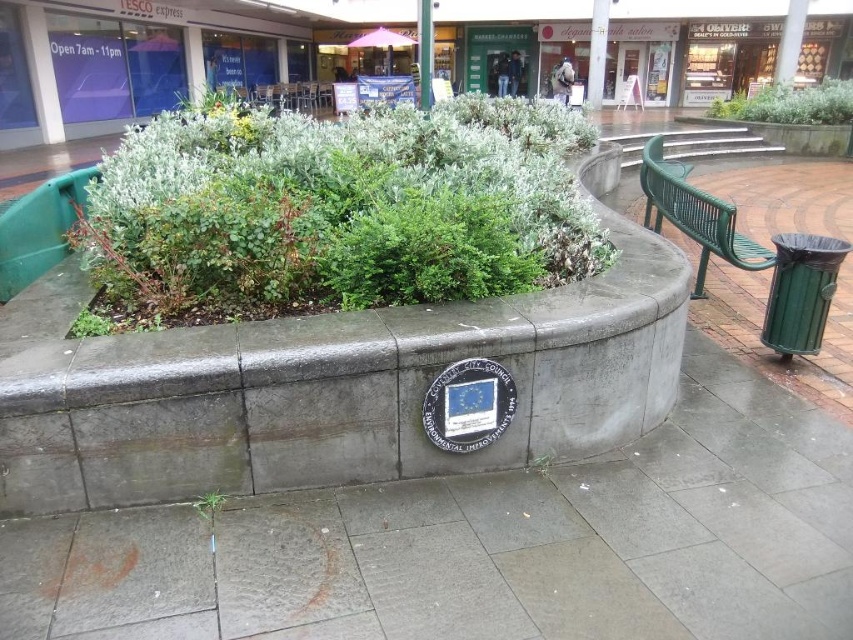
Is gray concrete pavement at center below green leafy bush at upper center?

Correct, gray concrete pavement at center is located below green leafy bush at upper center.

Is gray concrete pavement at center taller than green leafy bush at upper center?

In fact, gray concrete pavement at center may be shorter than green leafy bush at upper center.

Is point (819, 460) positioned in front of point (834, 96)?

Yes.

Identify the location of gray concrete pavement at center. Image resolution: width=853 pixels, height=640 pixels. (486, 545).

Which is behind, point (206, 508) or point (540, 467)?

Point (540, 467)

Find the location of a particular element. This screenshot has height=640, width=853. green leafy plant at lower center is located at coordinates click(x=209, y=502).

Can you confirm if gray concrete pavement at center is positioned to the left of green leafy plant at lower center?

In fact, gray concrete pavement at center is to the right of green leafy plant at lower center.

Who is shorter, gray concrete pavement at center or green leafy plant at lower center?

green leafy plant at lower center

Locate an element on the screen. Image resolution: width=853 pixels, height=640 pixels. gray concrete pavement at center is located at coordinates (486, 545).